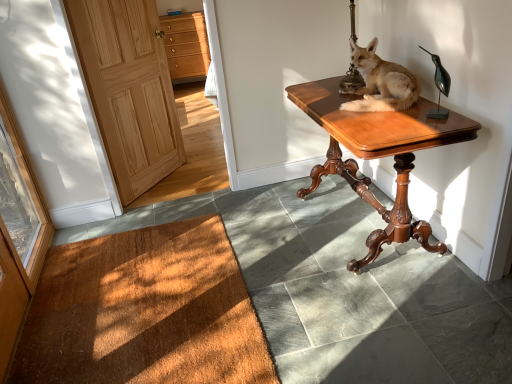
Locate an element on the screen. The width and height of the screenshot is (512, 384). free location in front of mahogany wood desk at center is located at coordinates coord(387,318).